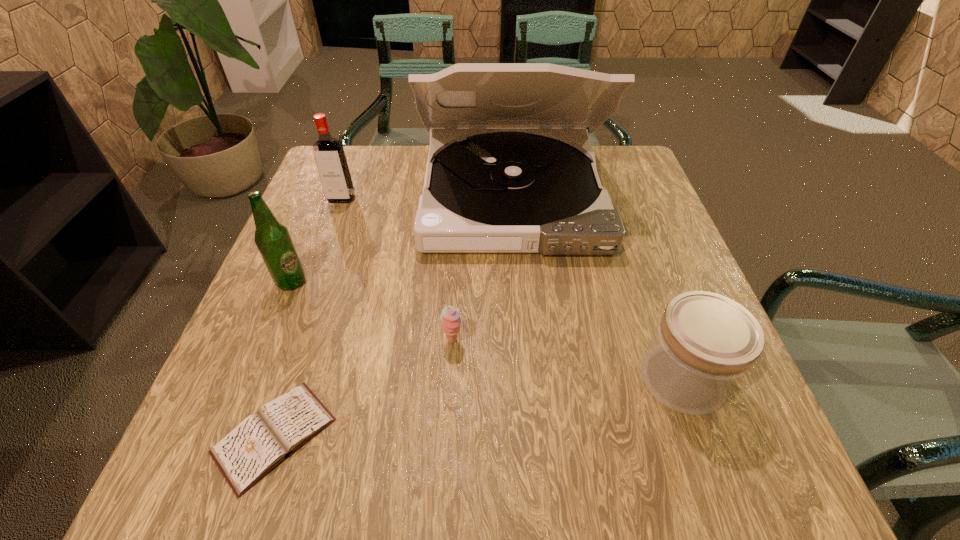
Identify the location of vacant region located 0.110m on the right of the sherbert. The height and width of the screenshot is (540, 960). (522, 341).

Locate an element on the screen. free space located on the right of the shortest object is located at coordinates (391, 436).

This screenshot has height=540, width=960. I want to click on CD player located in the far edge section of the desktop, so click(x=502, y=177).

Where is `vodka at the far edge`? The height and width of the screenshot is (540, 960). vodka at the far edge is located at coordinates (332, 165).

You are a GUI agent. You are given a task and a screenshot of the screen. Output one action in this format:
    pyautogui.click(x=<x>, y=<y>)
    Task: Click on the object at the near edge
    The image size is (960, 540).
    Given the screenshot: What is the action you would take?
    pyautogui.click(x=260, y=442)

Image resolution: width=960 pixels, height=540 pixels. I want to click on vodka present at the left edge, so click(332, 165).

Image resolution: width=960 pixels, height=540 pixels. I want to click on beer bottle at the left edge, so click(x=273, y=240).

Where is `diary located at the left edge`? The width and height of the screenshot is (960, 540). diary located at the left edge is located at coordinates (260, 442).

You are a GUI agent. You are given a task and a screenshot of the screen. Output one action in this format:
    pyautogui.click(x=<x>, y=<y>)
    Task: Click on the CD player at the right edge
    This screenshot has width=960, height=540.
    Given the screenshot: What is the action you would take?
    pyautogui.click(x=502, y=177)

The width and height of the screenshot is (960, 540). I want to click on jar at the right edge, so click(x=705, y=343).